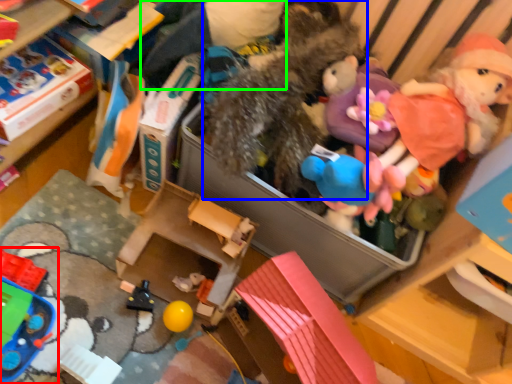
Question: Estimate the real-world distances between objects in this image. Which object is farther from toy (highlighted by a red box), toy (highlighted by a blue box) or clothing (highlighted by a green box)?

Choices:
 (A) toy
 (B) clothing

Answer: (B)